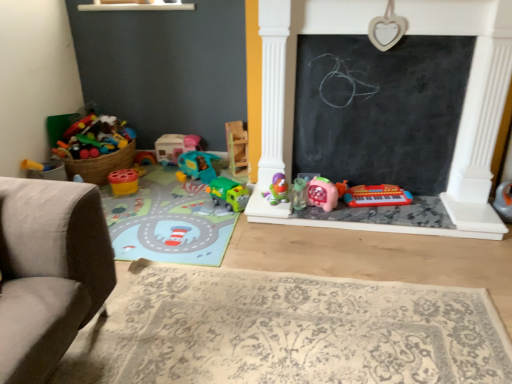
The width and height of the screenshot is (512, 384). What are the coordinates of `free space between green plastic truck at center, the seventh toy viewed from the right, and matte plastic cup at center-left, acting as the 10th toy starting from the right` in the screenshot? It's located at (174, 195).